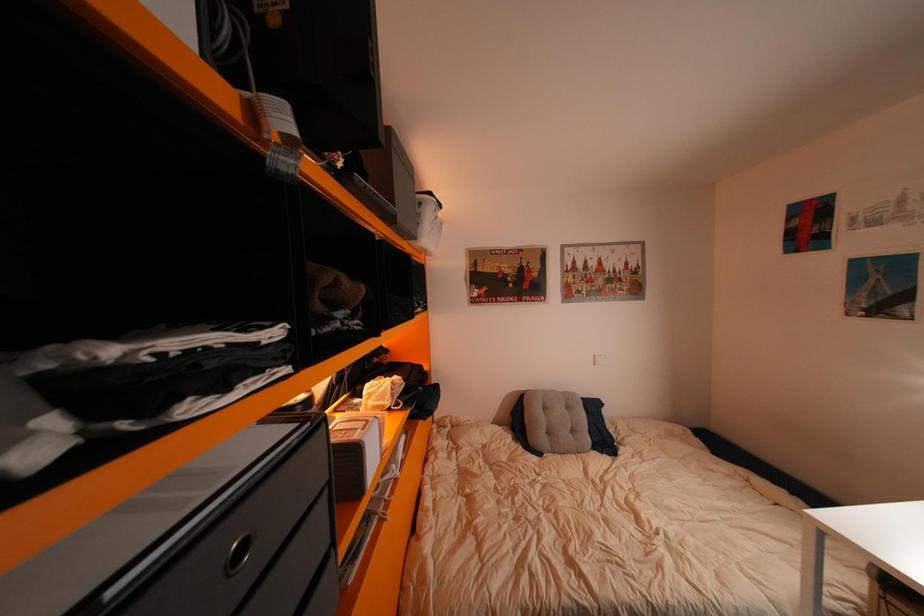
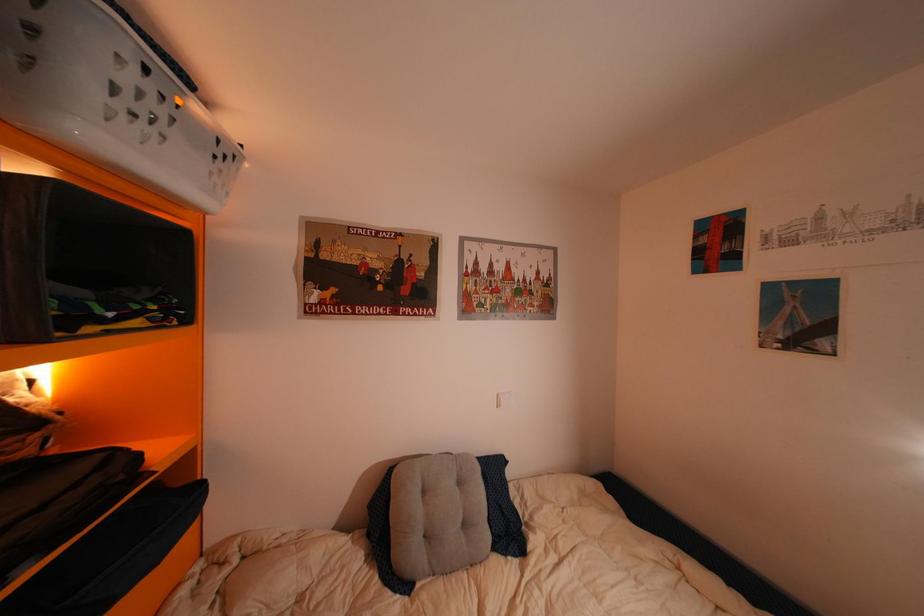
Question: The images are taken continuously from a first-person perspective. In which direction is your viewpoint rotating?

Choices:
 (A) Left
 (B) Right
 (C) Up
 (D) Down

Answer: (B)